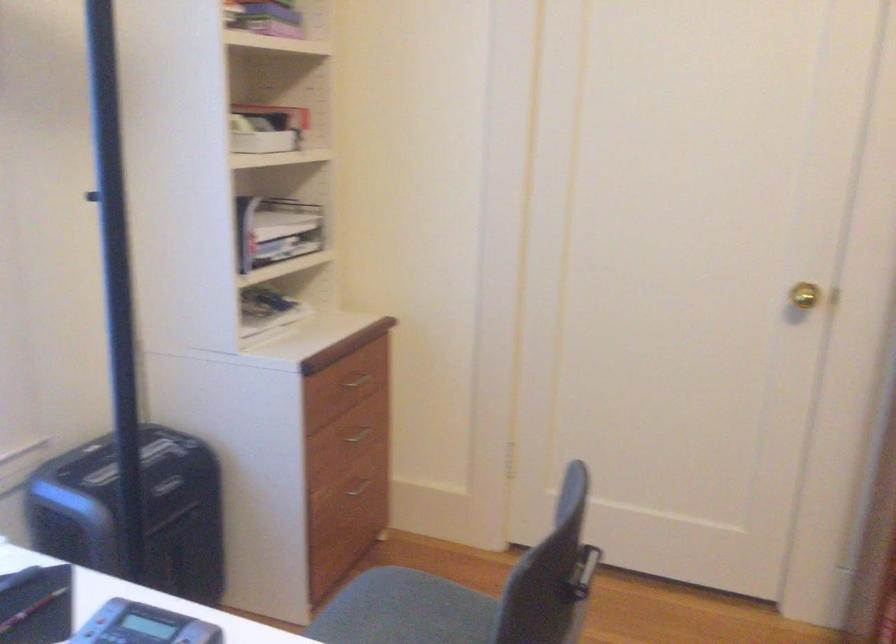
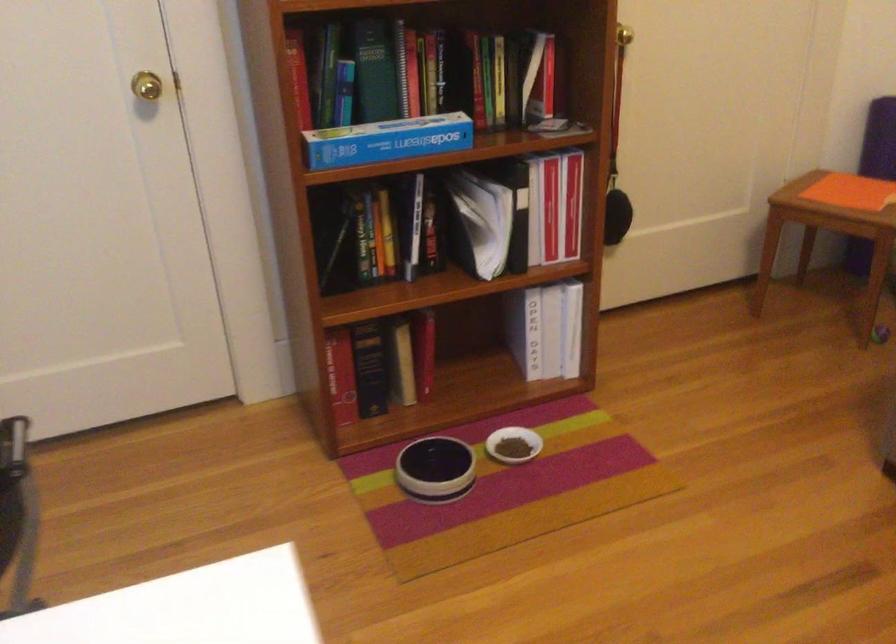
The images are taken continuously from a first-person perspective. In which direction is your viewpoint rotating?

The camera's rotation is toward right-down.